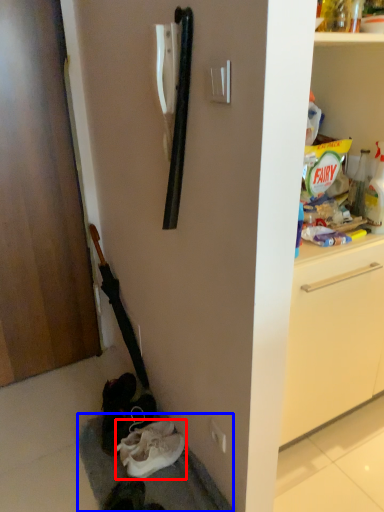
Question: Which object is closer to the camera taking this photo, shoe (highlighted by a red box) or gray (highlighted by a blue box)?

Choices:
 (A) shoe
 (B) gray

Answer: (B)